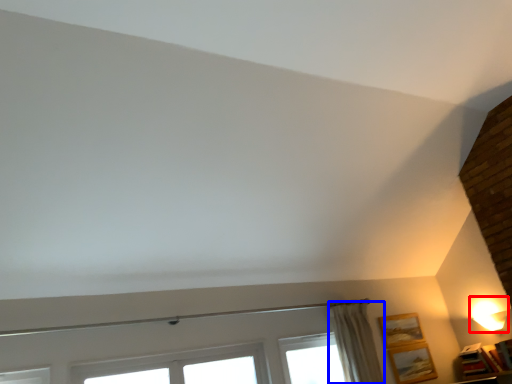
Question: Which of the following is the farthest to the observer, table lamp (highlighted by a red box) or curtain (highlighted by a blue box)?

Choices:
 (A) table lamp
 (B) curtain

Answer: (A)